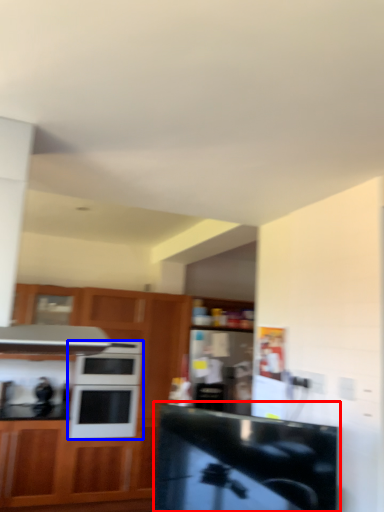
Question: Which of the following is the closest to the observer, counter top (highlighted by a red box) or microwave oven (highlighted by a blue box)?

Choices:
 (A) counter top
 (B) microwave oven

Answer: (A)